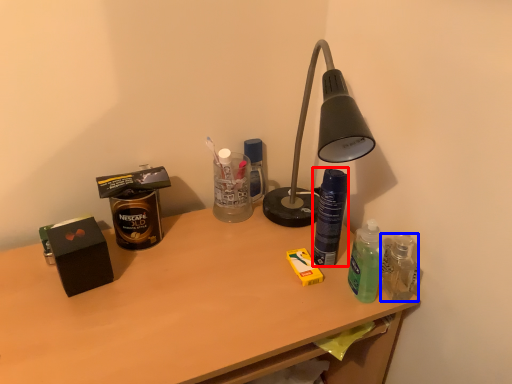
Question: Which point is further to the camera, bottle (highlighted by a red box) or bottle (highlighted by a blue box)?

Choices:
 (A) bottle
 (B) bottle

Answer: (A)